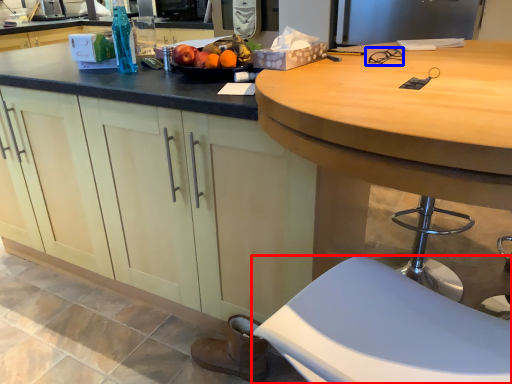
Question: Among these objects, which one is nearest to the camera, stool (highlighted by a red box) or glasses (highlighted by a blue box)?

Choices:
 (A) stool
 (B) glasses

Answer: (A)